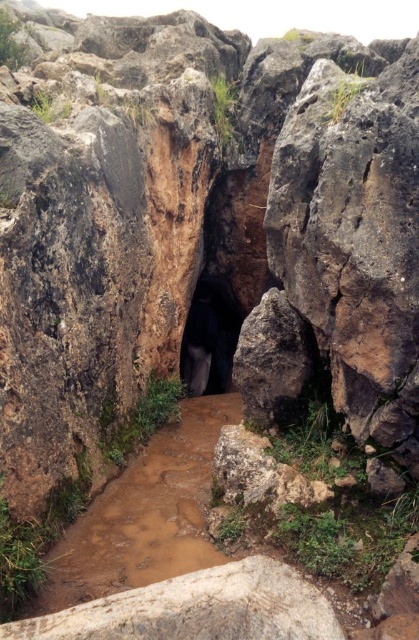
You are an explorer carrying a 3D printed model of the cave entrance. The model shows the brown muddy stream at center and the black matte entrance at center. Which object in the model is bigger?

The brown muddy stream at center has a larger size compared to the black matte entrance at center.

You are a hiker exploring the rock formation and want to cross the brown muddy stream at center. You notice a point marked at coordinate [144,515]. Based on the scene description, what is located at that point?

The point at coordinate [144,515] corresponds to the brown muddy stream at center, as indicated in the objects description.

You are an explorer carrying a 1.2 meter wide equipment box. You need to pass through the entrance to the cave. The entrance has a brown muddy stream at center and a black matte entrance at center. Which path should you choose to ensure your equipment can fit through?

The brown muddy stream at center is wider than the black matte entrance at center, so you should choose the brown muddy stream at center to pass through with your equipment.